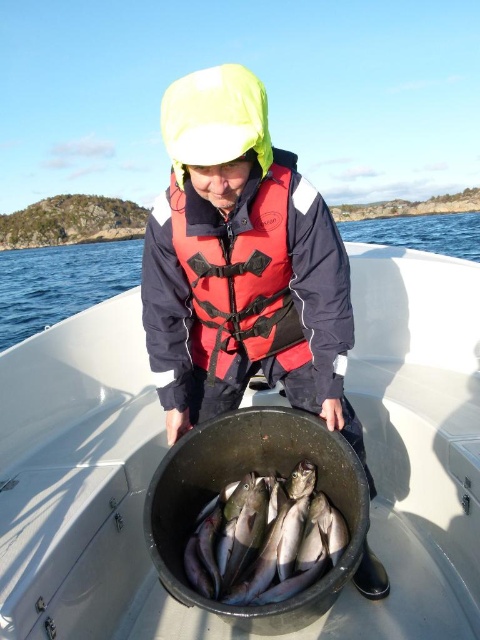
Is point (400, 605) behind point (212, 81)?

Yes, it is behind point (212, 81).

Consider the image. Does black plastic bucket at center appear on the right side of matte black jacket at center?

Yes, black plastic bucket at center is to the right of matte black jacket at center.

Identify the location of black plastic bucket at center. click(x=84, y=484).

Who is higher up, black plastic bucket at center or red matte life jacket at center?

red matte life jacket at center is above.

Is black plastic bucket at center to the left of red matte life jacket at center from the viewer's perspective?

In fact, black plastic bucket at center is to the right of red matte life jacket at center.

Is point (412, 280) in front of point (210, 291)?

No, it is not.

In order to click on black plastic bucket at center in this screenshot , I will do `click(84, 484)`.

Is the position of matte black jacket at center less distant than that of clear blue water at center?

Yes, it is.

Is point (249, 284) in front of point (103, 275)?

Yes.

At what (x,y) coordinates should I click in order to perform the action: click on matte black jacket at center. Please return your answer as a coordinate pair (x, y). Looking at the image, I should click on click(x=241, y=266).

This screenshot has width=480, height=640. I want to click on matte black jacket at center, so click(241, 266).